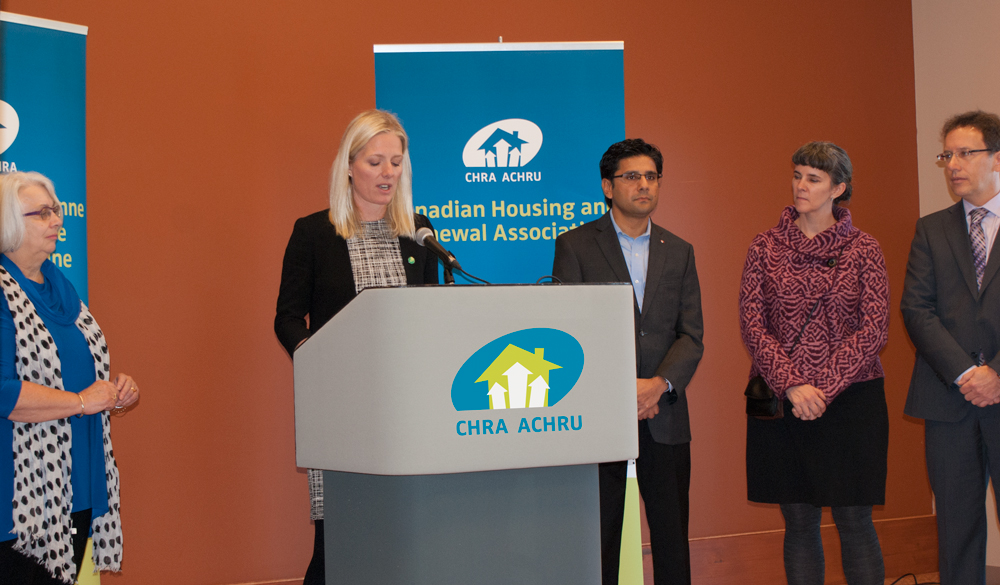
You are a GUI agent. You are given a task and a screenshot of the screen. Output one action in this format:
    pyautogui.click(x=<x>, y=<y>)
    Task: Click on the wall
    This screenshot has width=1000, height=585.
    Given the screenshot: What is the action you would take?
    pyautogui.click(x=309, y=96)